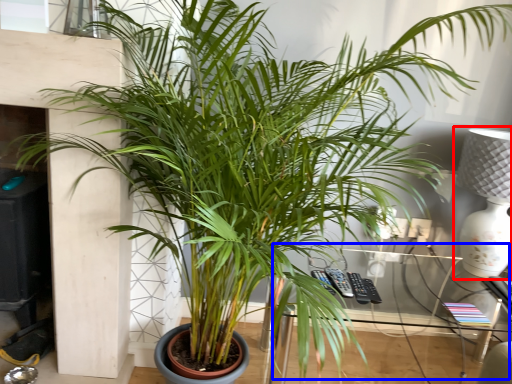
Question: Which object is further to the camera taking this photo, table lamp (highlighted by a red box) or table (highlighted by a blue box)?

Choices:
 (A) table lamp
 (B) table

Answer: (A)